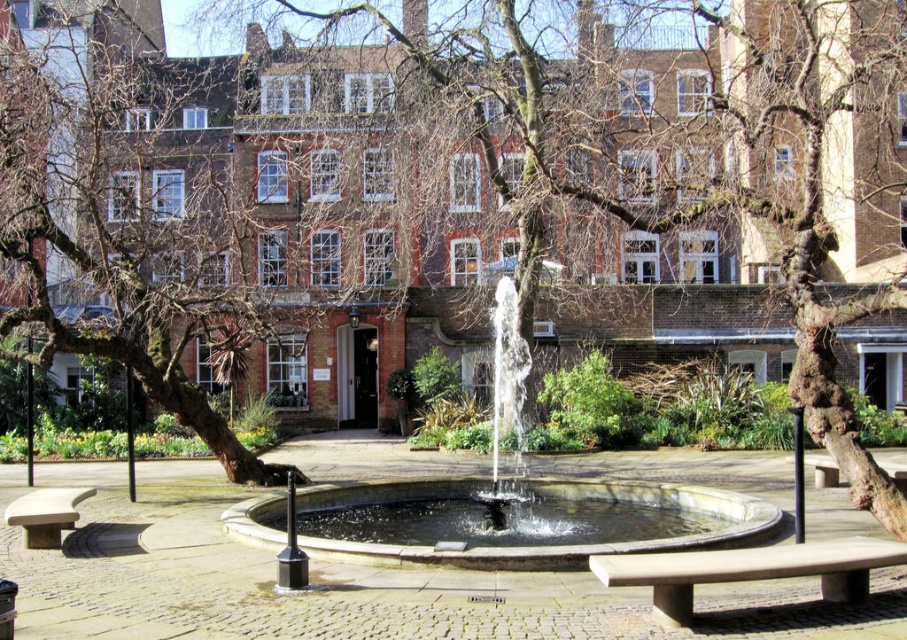
You are a visitor in the courtyard and want to sit on the smooth stone bench at lower left. To reach it, you need to walk from the fountain. Which direction should you walk relative to the bare bark tree at center?

The smooth stone bench at lower left is located below the bare bark tree at center, so you should walk downward or southward from the fountain towards the bench.

Based on the photo, you are standing in the courtyard and want to move from the point at coordinates point (x=36, y=221) to the point at coordinates point (x=83, y=493). Which direction should you walk to get closer to your destination?

You should walk forward because point (x=36, y=221) is behind point (x=83, y=493), so moving forward will bring you closer to your destination.

You are standing in the courtyard and want to sit on the smooth stone bench at lower left. However, there is a brown bark tree at left in your way. Can you walk around the tree to reach the bench without going through it?

The smooth stone bench at lower left is behind the brown bark tree at left, so you can walk around the tree to reach the bench without going through it.